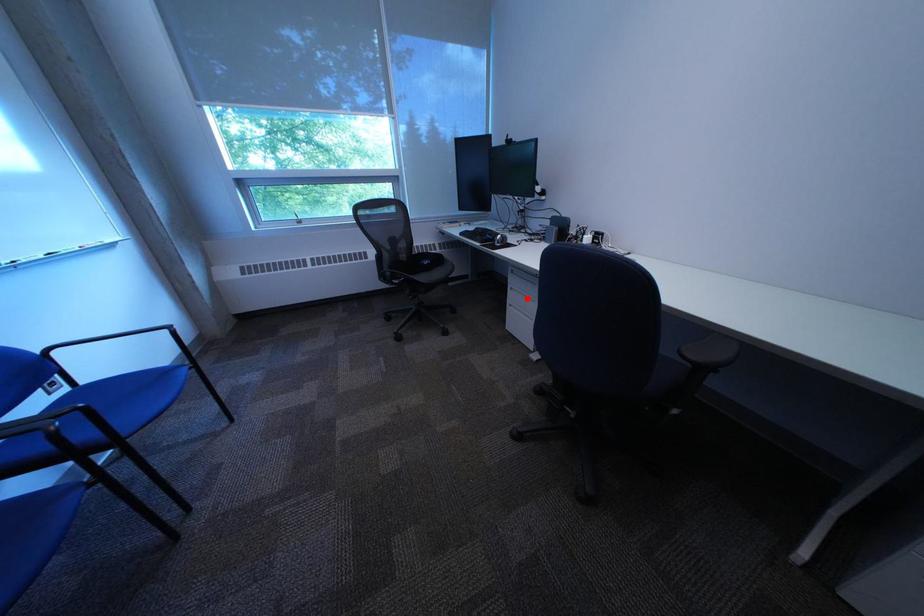
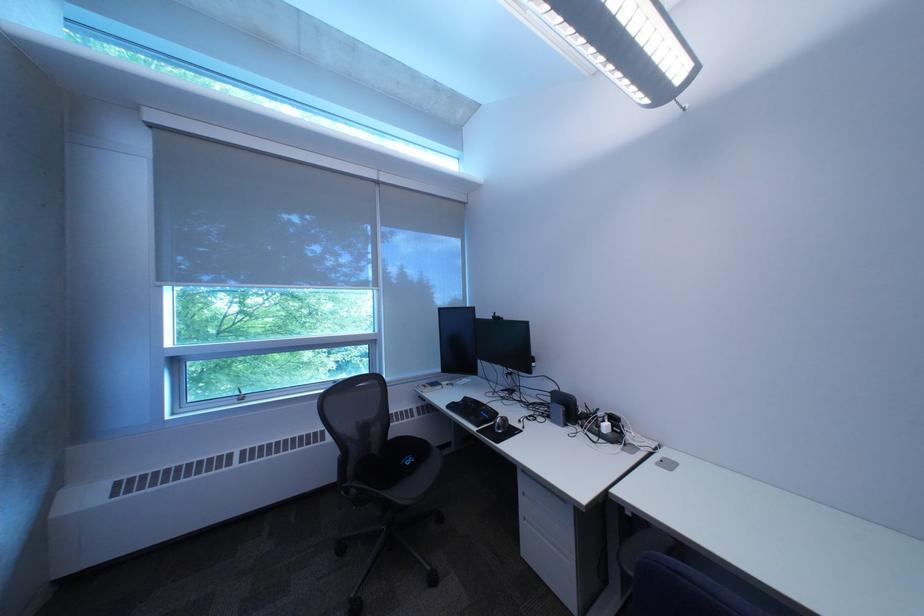
Question: I am providing you with two images of the same scene from different viewpoints. In image1, a red point is highlighted. Considering the same 3D point in image2, which of the following is correct?

Choices:
 (A) It is closer
 (B) It is farther

Answer: (B)